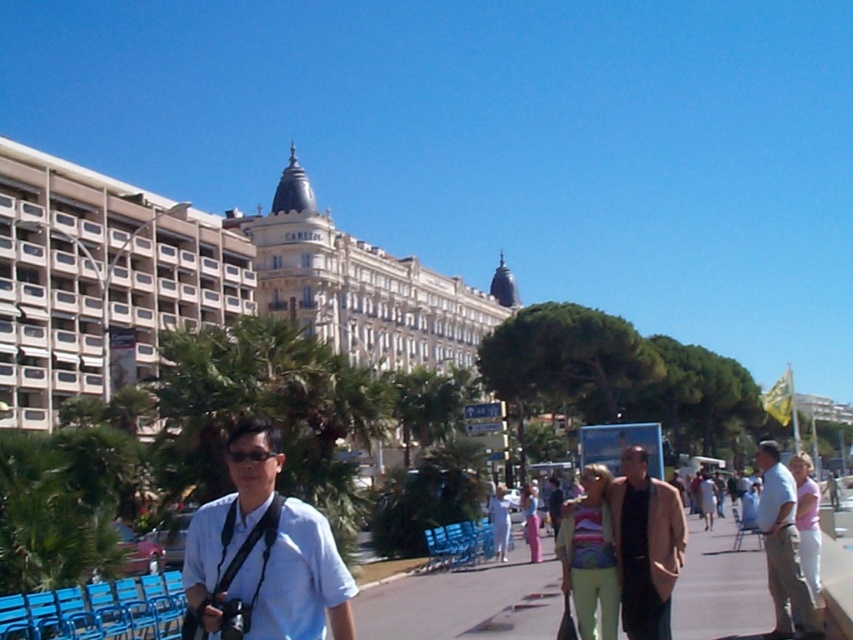
Is white textured building at upper left above dark brown leather jacket at center?

Correct, white textured building at upper left is located above dark brown leather jacket at center.

Is point (199, 275) positioned in front of point (627, 580)?

That is False.

Locate an element on the screen. This screenshot has width=853, height=640. white textured building at upper left is located at coordinates (99, 280).

Does white stone building at center appear under white textured building at upper left?

No.

Is white stone building at center thinner than white textured building at upper left?

In fact, white stone building at center might be wider than white textured building at upper left.

Does point (381, 307) lie in front of point (19, 177)?

That is False.

Identify the location of white stone building at center. The width and height of the screenshot is (853, 640). (198, 282).

Is white stone building at center taller than smooth concrete sidewalk at center?

Correct, white stone building at center is much taller as smooth concrete sidewalk at center.

Which is in front, point (102, 193) or point (520, 564)?

Positioned in front is point (520, 564).

Identify the location of white stone building at center. The width and height of the screenshot is (853, 640). (198, 282).